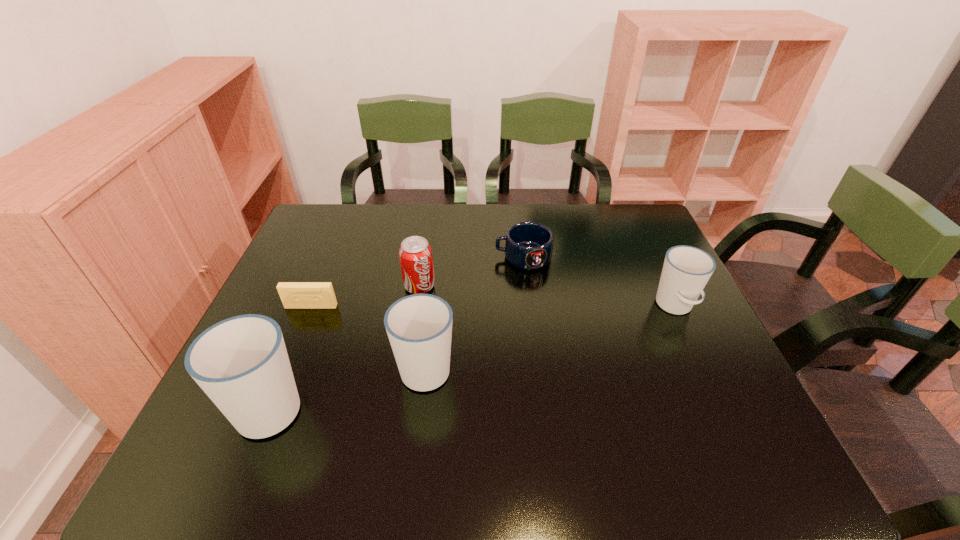
What are the coordinates of `free space at the far left corner` in the screenshot? It's located at (299, 242).

Locate an element on the screen. vacant space at the far right corner of the desktop is located at coordinates point(612,205).

You are a GUI agent. You are given a task and a screenshot of the screen. Output one action in this format:
    pyautogui.click(x=<x>, y=<y>)
    Task: Click on the vacant region at the near right corner of the desktop
    The width and height of the screenshot is (960, 540).
    Given the screenshot: What is the action you would take?
    pyautogui.click(x=680, y=392)

Identify the location of vacant area that lies between the leftmost cup and the rightmost object. This screenshot has height=540, width=960. (473, 356).

Identify the location of vacant space that's between the second cup from left to right and the second object from right to left. (474, 312).

This screenshot has height=540, width=960. What are the coordinates of `free point between the soda and the videotape` in the screenshot? It's located at (365, 296).

The width and height of the screenshot is (960, 540). Identify the location of free space between the soda and the videotape. (365, 296).

Locate an element on the screen. unoccupied area between the videotape and the leftmost cup is located at coordinates (291, 356).

You are a GUI agent. You are given a task and a screenshot of the screen. Output one action in this format:
    pyautogui.click(x=<x>, y=<y>)
    Task: Click on the vacant area between the soda and the leftmost cup
    This screenshot has width=960, height=540.
    Given the screenshot: What is the action you would take?
    pyautogui.click(x=346, y=346)

This screenshot has width=960, height=540. In order to click on free point between the rightmost object and the videotape in this screenshot , I will do `click(492, 307)`.